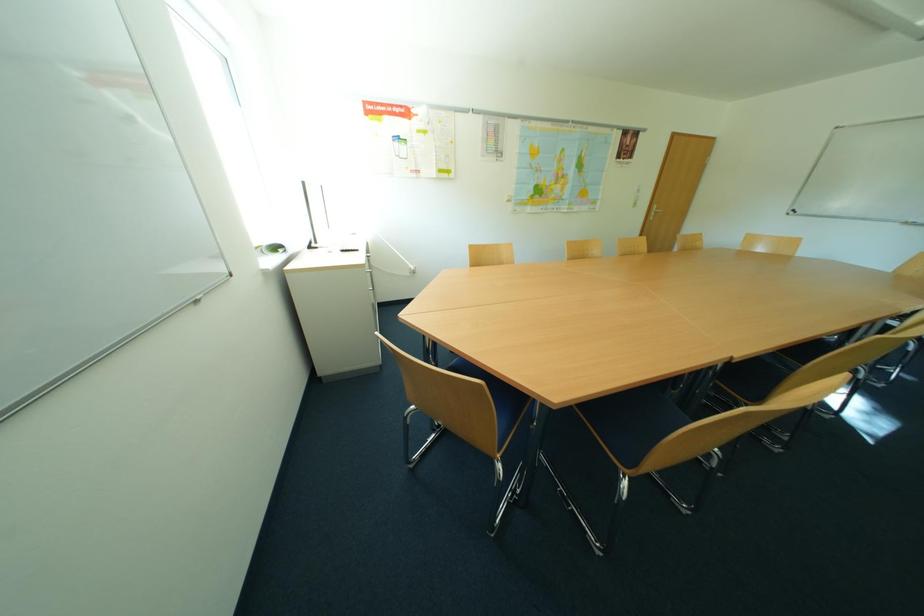
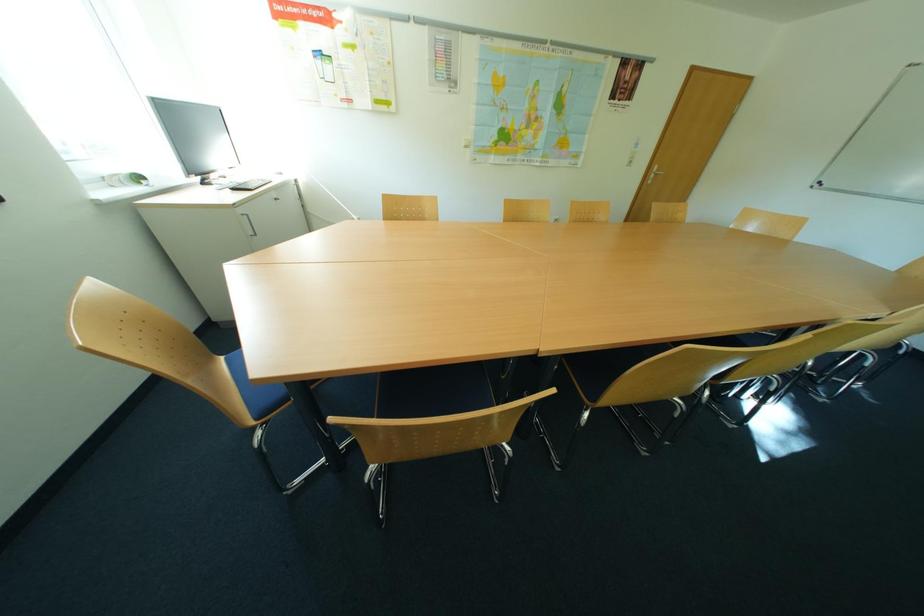
Question: The first image is from the beginning of the video and the second image is from the end. How did the camera likely rotate when shooting the video?

Choices:
 (A) Left
 (B) Right
 (C) Up
 (D) Down

Answer: (D)